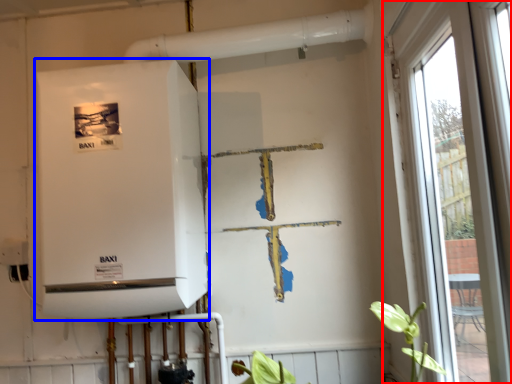
Question: Among these objects, which one is nearest to the camera, window (highlighted by a red box) or appliance (highlighted by a blue box)?

Choices:
 (A) window
 (B) appliance

Answer: (A)